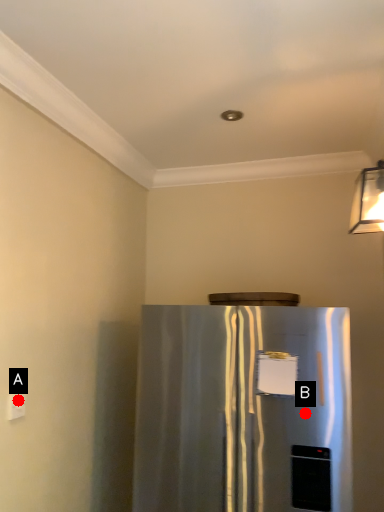
Question: Two points are circled on the image, labeled by A and B beside each circle. Which point is closer to the camera?

Choices:
 (A) A is closer
 (B) B is closer

Answer: (A)